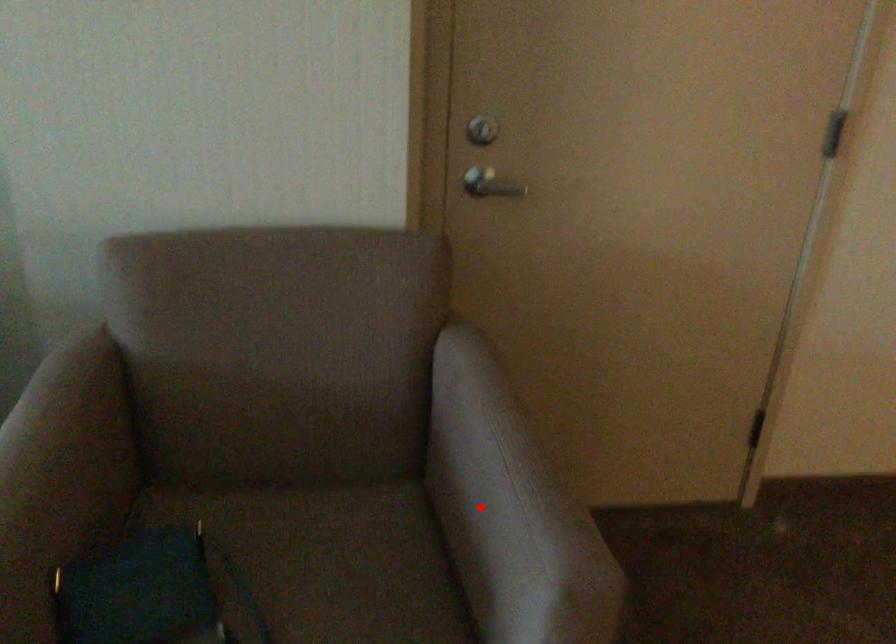
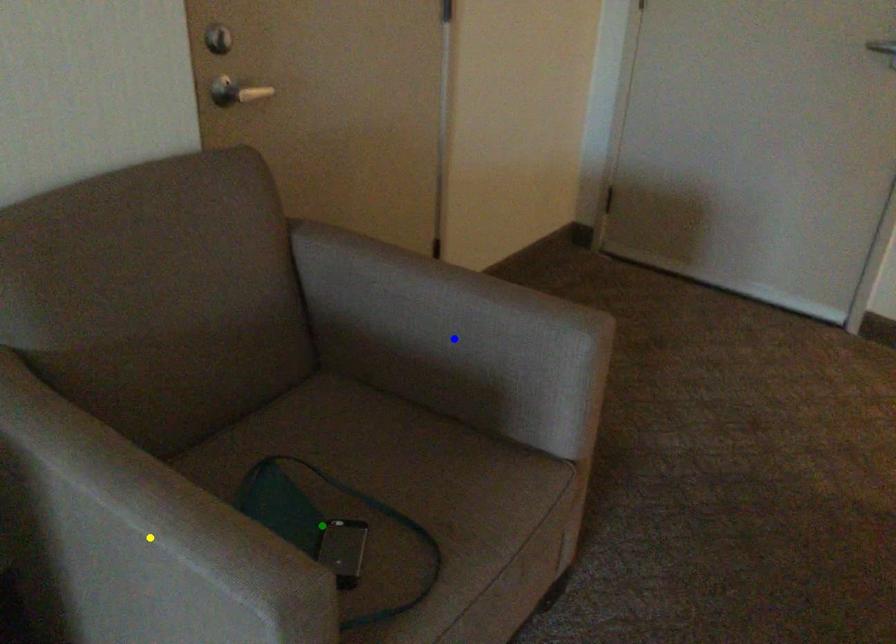
Question: I am providing you with two images of the same scene from different viewpoints. A red point is marked on the first image. You are given multiple points on the second image. Which spot in image 2 lines up with the point in image 1?

Choices:
 (A) yellow point
 (B) blue point
 (C) green point

Answer: (B)